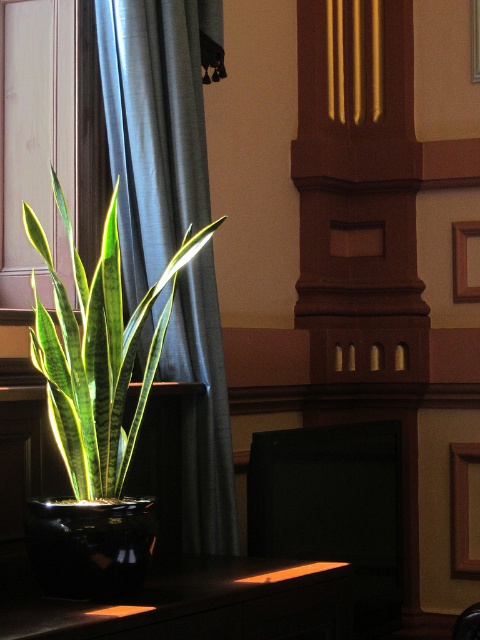
You are an interior designer planning to place a new painting on the wall. The painting is 1 meter wide and needs to be centered between the satin blue curtain at left and the edge of the wall. If the wall is 3 meters wide, can the painting fit without overlapping the curtain?

The position of the satin blue curtain at left is at point (155, 125), but without specific measurements of the wall edges or distances between the curtain and the wall edge, it is impossible to determine if the painting will fit. More information is needed to answer this question accurately.

Looking at this image, you are an interior designer arranging items on a shelf. You have a green glossy snake plant at left and a brown wooden picture frame at center. You need to place a decorative vase between them. Is there enough space for the vase if it requires at least 2 feet of space?

The distance between the green glossy snake plant at left and the brown wooden picture frame at center is 8.49 feet. Since the vase requires at least 2 feet of space, there is more than enough room to place it between them.

You are arranging a new lamp in the room and want to ensure it doesn not block the view of both the satin blue curtain at left and the green glossy snake plant at left. Given their sizes, which object should you place the lamp closer to to avoid blocking them?

The satin blue curtain at left is larger in size than the green glossy snake plant at left. To avoid blocking their view, place the lamp closer to the smaller green glossy snake plant at left since it occupies less space.